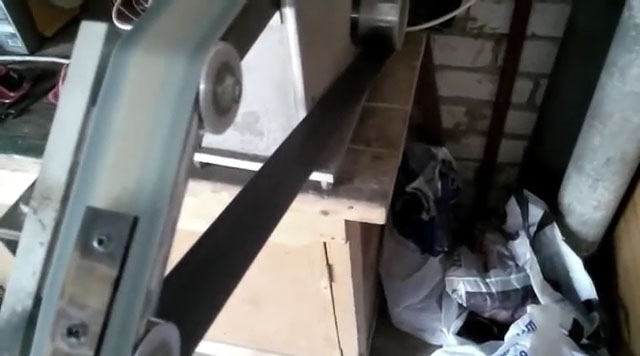
Image resolution: width=640 pixels, height=356 pixels. Identify the location of hinge. pyautogui.click(x=329, y=266).